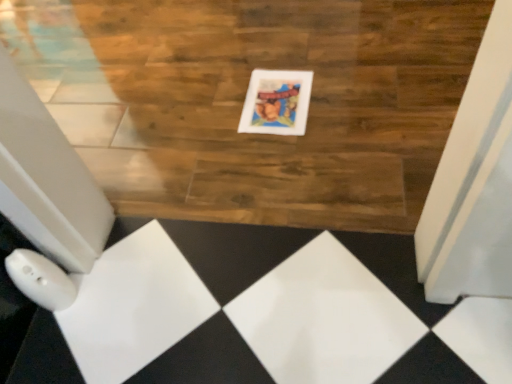
I want to click on free spot below white glossy picture frame at center (from a real-world perspective), so click(277, 100).